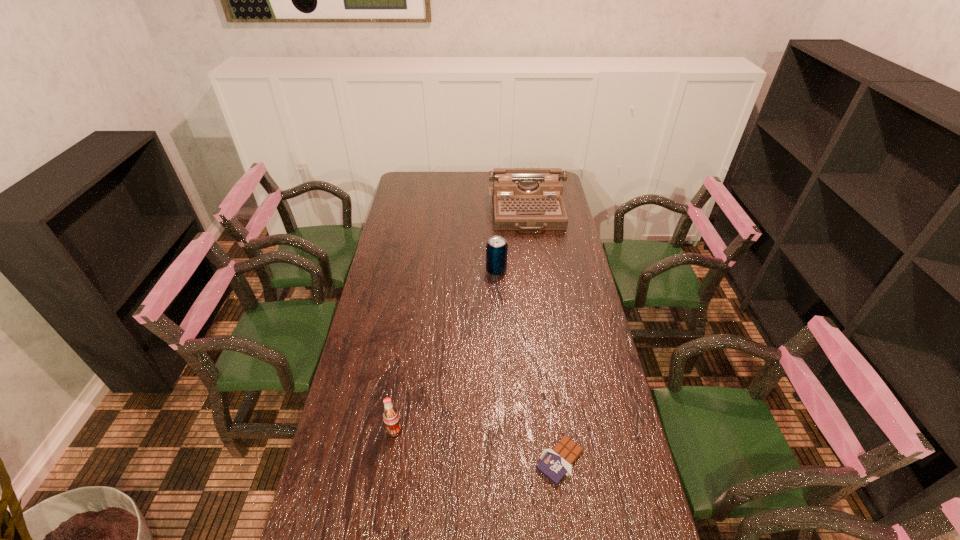
You are a GUI agent. You are given a task and a screenshot of the screen. Output one action in this format:
    pyautogui.click(x=<x>, y=<y>)
    Task: Click on the vacant area situated on the left of the shortest object
    
    Given the screenshot: What is the action you would take?
    pyautogui.click(x=484, y=460)

Image resolution: width=960 pixels, height=540 pixels. In order to click on object that is at the far edge in this screenshot , I will do `click(523, 198)`.

The height and width of the screenshot is (540, 960). Find the location of `object positioned at the left edge`. object positioned at the left edge is located at coordinates (391, 417).

The height and width of the screenshot is (540, 960). I want to click on typewriter located in the right edge section of the desktop, so click(523, 198).

Locate an element on the screen. The width and height of the screenshot is (960, 540). chocolate bar at the right edge is located at coordinates (555, 463).

Identify the location of object at the far right corner. (523, 198).

Locate an element on the screen. The image size is (960, 540). vacant area at the far edge of the desktop is located at coordinates (483, 177).

What are the coordinates of `vacant space at the left edge` in the screenshot? It's located at (424, 216).

Image resolution: width=960 pixels, height=540 pixels. I want to click on vacant space at the right edge of the desktop, so click(573, 233).

This screenshot has width=960, height=540. In the image, there is a desktop. Find the location of `vacant space at the far left corner`. vacant space at the far left corner is located at coordinates (416, 172).